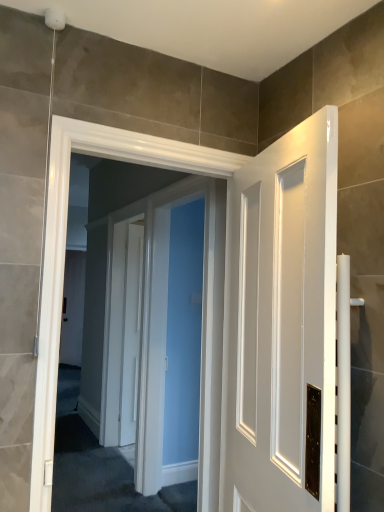
Question: Considering the relative sizes of white glossy door at center and white glossy door at center in the image provided, is white glossy door at center wider than white glossy door at center?

Choices:
 (A) yes
 (B) no

Answer: (B)

Question: Is white glossy door at center taller than white glossy door at center?

Choices:
 (A) yes
 (B) no

Answer: (A)

Question: From the image's perspective, is white glossy door at center beneath white glossy door at center?

Choices:
 (A) yes
 (B) no

Answer: (A)

Question: From the image's perspective, does white glossy door at center appear higher than white glossy door at center?

Choices:
 (A) yes
 (B) no

Answer: (B)

Question: Does white glossy door at center appear on the right side of white glossy door at center?

Choices:
 (A) no
 (B) yes

Answer: (B)

Question: Is the position of white glossy door at center more distant than that of white glossy door at center?

Choices:
 (A) yes
 (B) no

Answer: (A)

Question: Is white glossy door at center to the left of white glossy door at center from the viewer's perspective?

Choices:
 (A) no
 (B) yes

Answer: (B)

Question: Are white glossy door at center and white glossy door at center located far from each other?

Choices:
 (A) yes
 (B) no

Answer: (B)

Question: From the image's perspective, would you say white glossy door at center is positioned over white glossy door at center?

Choices:
 (A) no
 (B) yes

Answer: (B)

Question: Does white glossy door at center have a greater width compared to white glossy door at center?

Choices:
 (A) yes
 (B) no

Answer: (A)

Question: From a real-world perspective, is white glossy door at center located beneath white glossy door at center?

Choices:
 (A) no
 (B) yes

Answer: (A)

Question: Is white glossy door at center facing towards white glossy door at center?

Choices:
 (A) no
 (B) yes

Answer: (B)

Question: From the image's perspective, is white glossy door at center above or below white glossy door at center?

Choices:
 (A) below
 (B) above

Answer: (A)